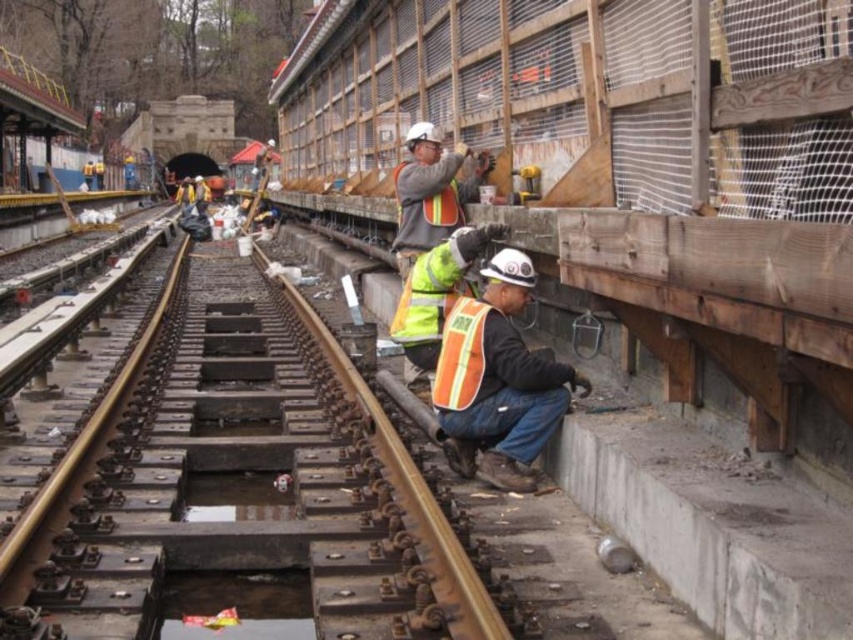
You are a safety inspector at the railway construction site. You notice the rusty metal track at center and the orange reflective vest at lower center. Based on their positions, which object is closer to the ground?

The rusty metal track at center is located below orange reflective vest at lower center, meaning it is closer to the ground than the orange reflective vest at lower center.

You are a safety inspector checking the railway site. You notice the rusty metal track at center and the reflective orange safety vest at lower center. Which object is wider in terms of physical dimensions?

The rusty metal track at center is wider than the reflective orange safety vest at lower center according to the description.